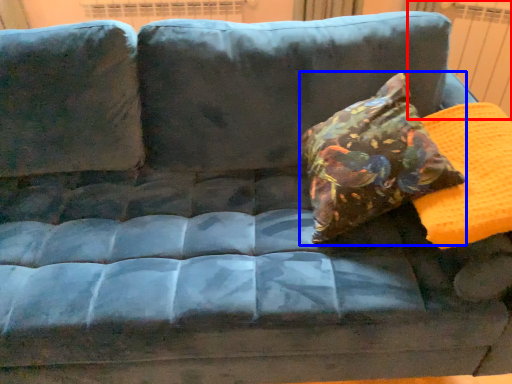
Question: Which point is closer to the camera, radiator (highlighted by a red box) or throw pillow (highlighted by a blue box)?

Choices:
 (A) radiator
 (B) throw pillow

Answer: (B)